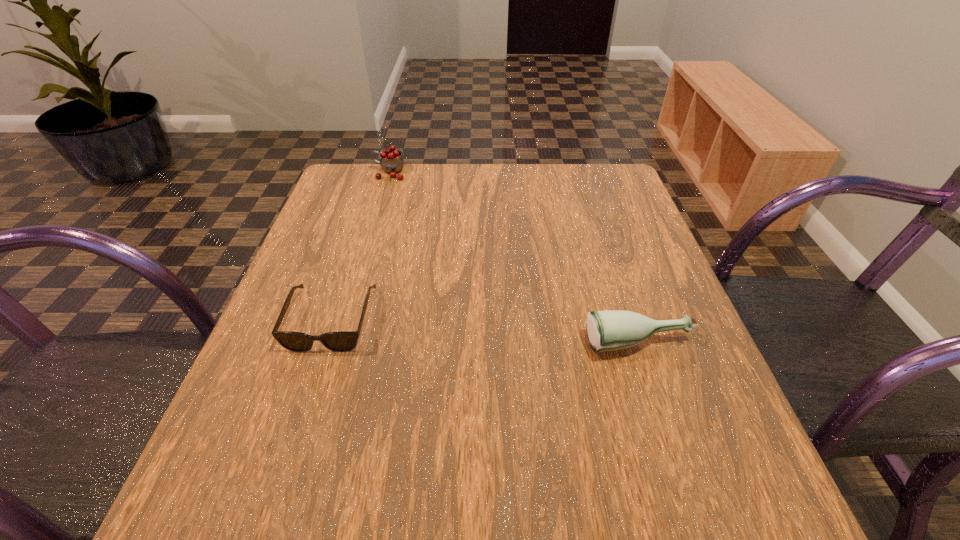
The height and width of the screenshot is (540, 960). I want to click on vacant area in the image that satisfies the following two spatial constraints: 1. at the front lenses of the sunglasses; 2. on the left side of the bottle, so pos(324,345).